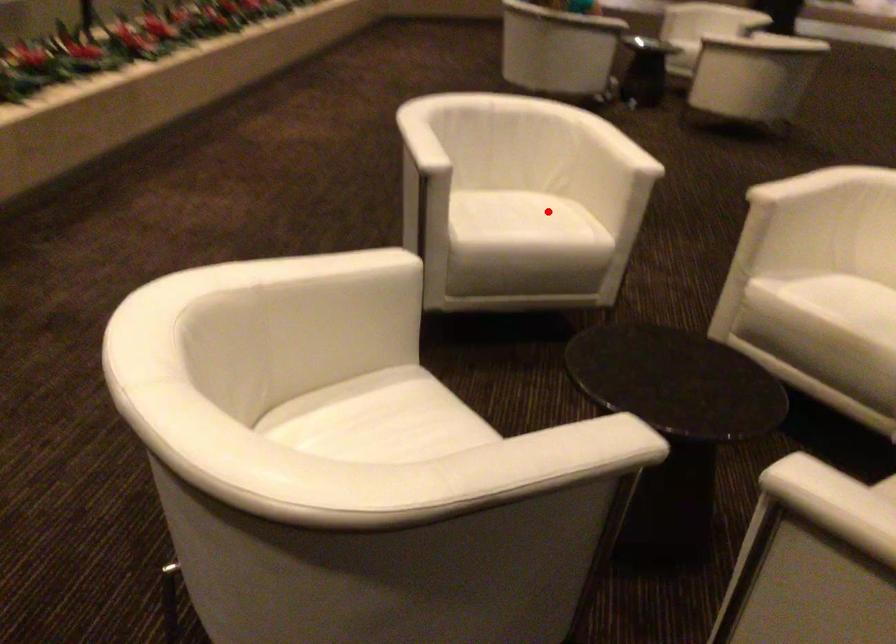
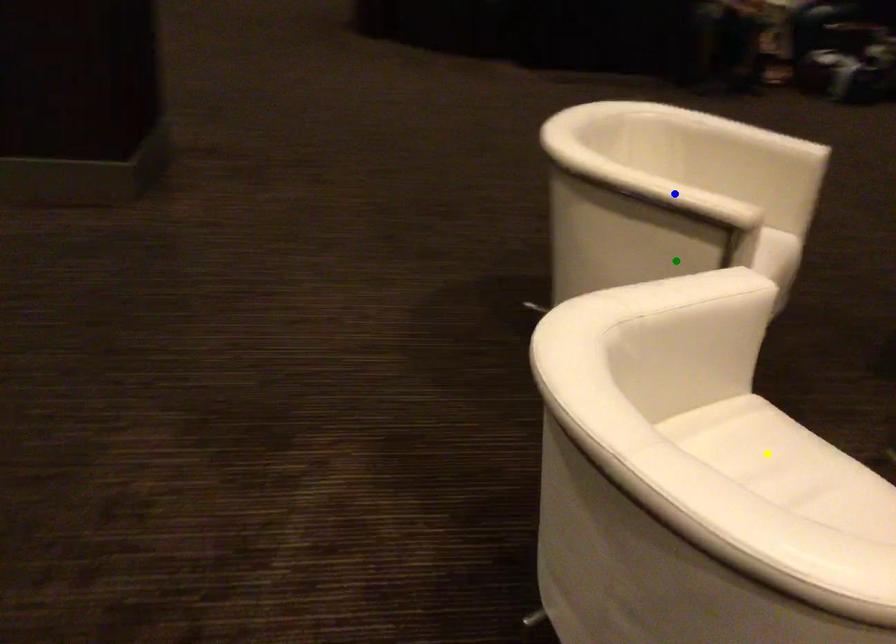
Question: I am providing you with two images of the same scene from different viewpoints. A red point is marked on the first image. You are given multiple points on the second image. Can you choose the point in image 2 that corresponds to the point in image 1?

Choices:
 (A) yellow point
 (B) blue point
 (C) green point

Answer: (A)